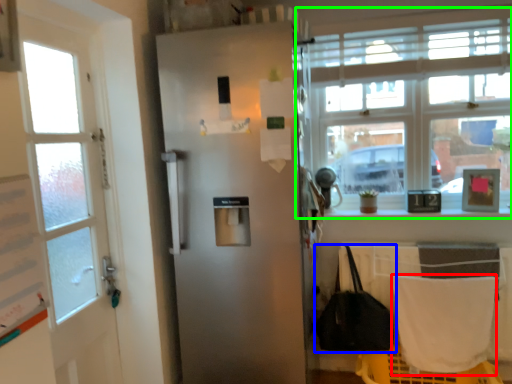
Question: Based on their relative distances, which object is nearer to blanket (highlighted by a red box)? Choose from handbag (highlighted by a blue box) and window (highlighted by a green box).

Choices:
 (A) handbag
 (B) window

Answer: (A)